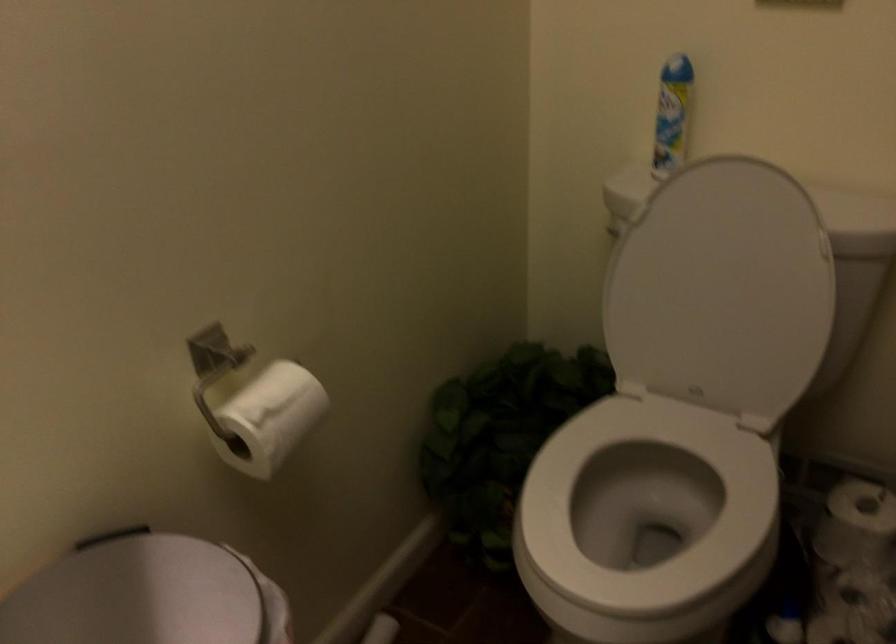
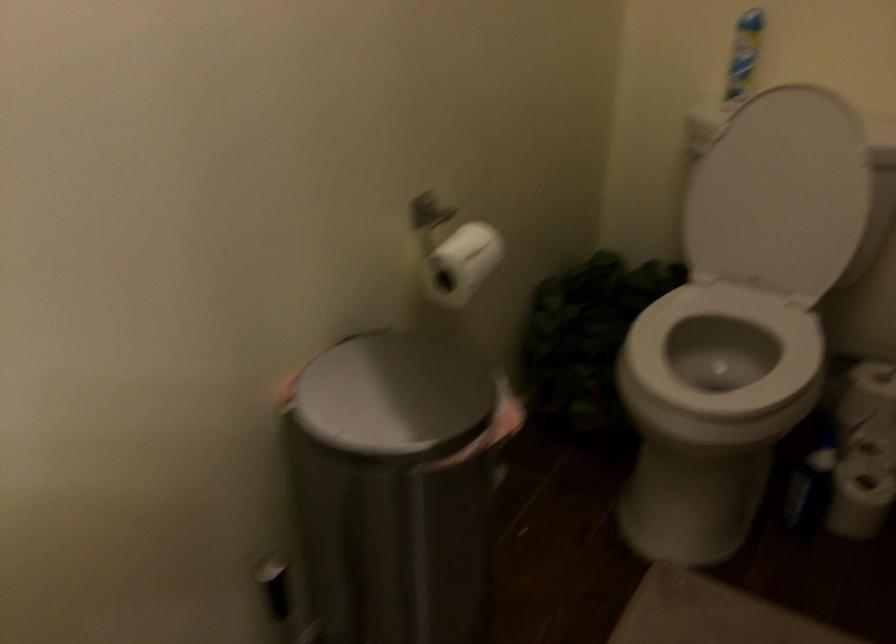
Question: The images are taken continuously from a first-person perspective. In which direction is your viewpoint rotating?

Choices:
 (A) Left
 (B) Right
 (C) Up
 (D) Down

Answer: (B)